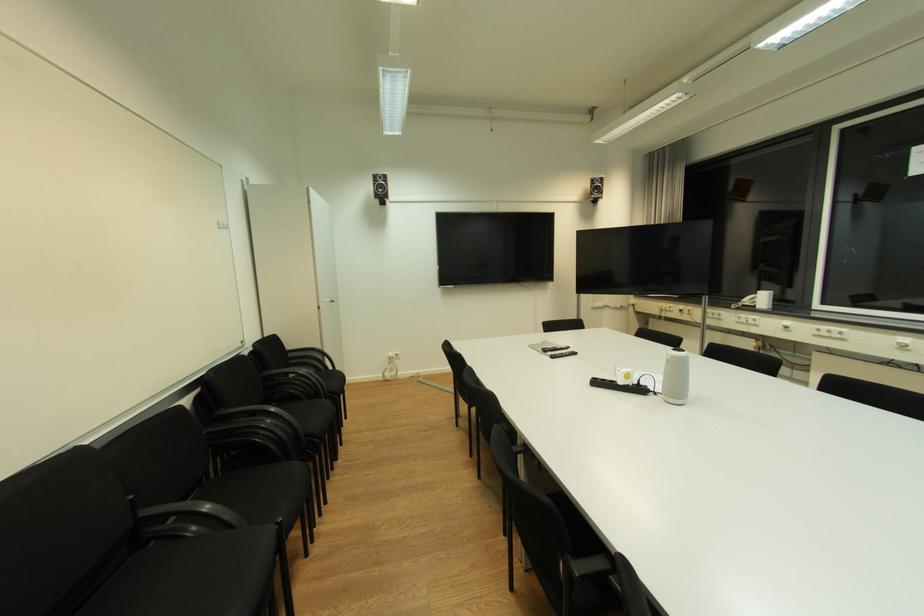
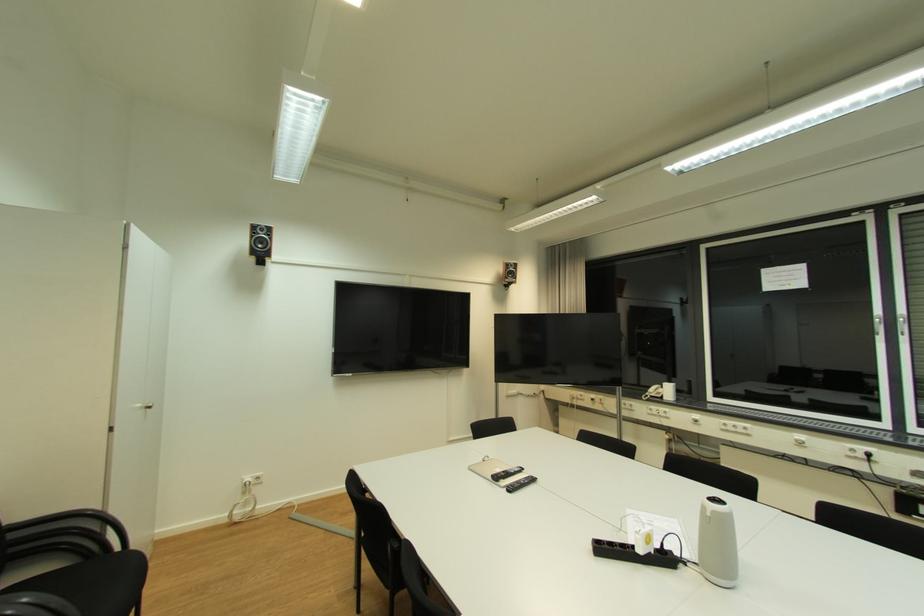
Locate, in the second image, the point that corresponds to point (551, 352) in the first image.

(502, 479)